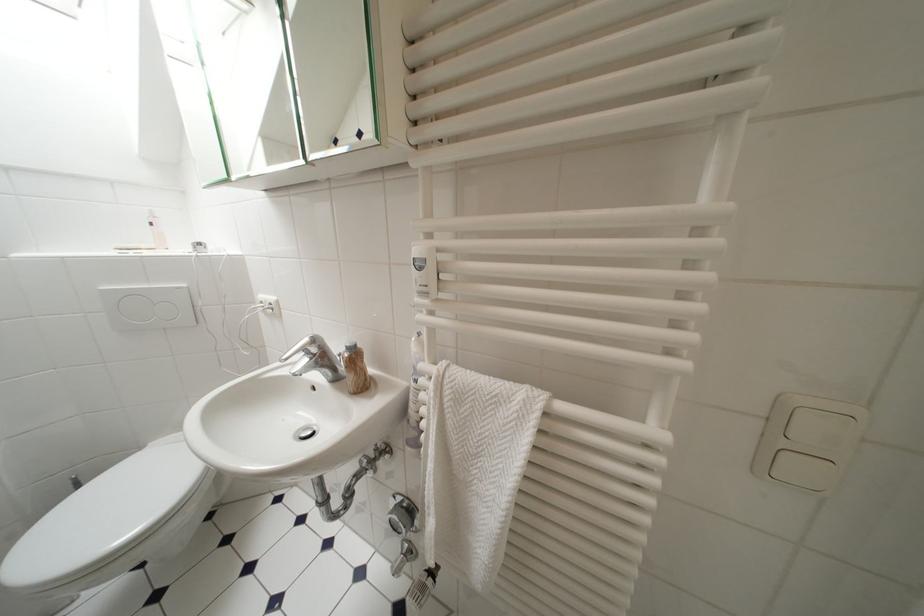
You are a GUI agent. You are given a task and a screenshot of the screen. Output one action in this format:
    pyautogui.click(x=<x>, y=<y>)
    Task: Click on the large flush button
    Image resolution: width=924 pixels, height=616 pixels.
    Given the screenshot: What is the action you would take?
    pyautogui.click(x=148, y=307)